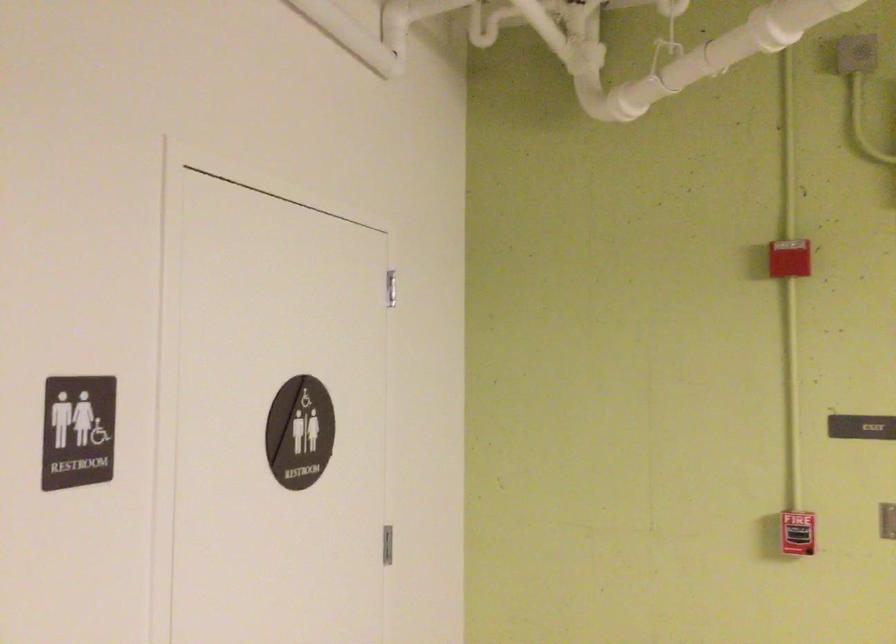
Where is `fire alarm handle`? fire alarm handle is located at coordinates (797, 533).